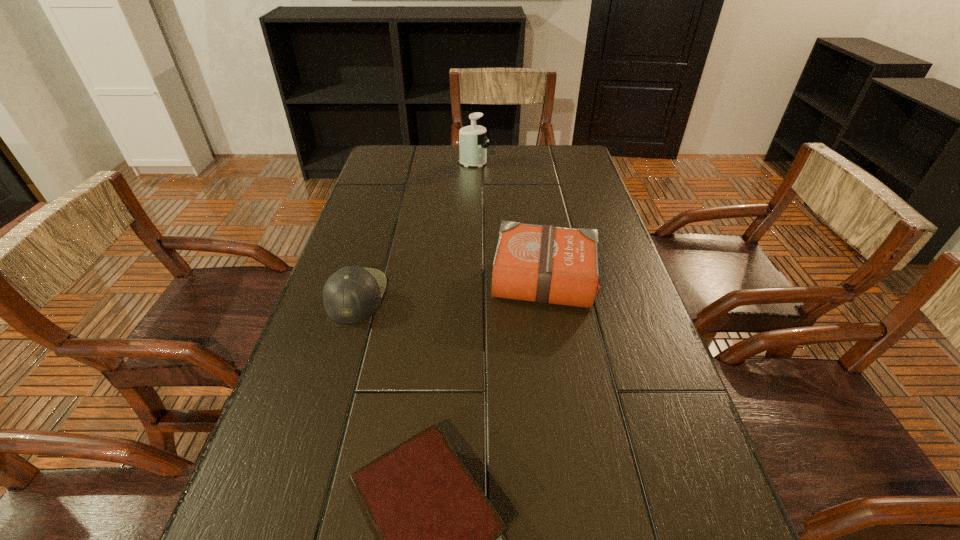
Find the location of a particular element. juicer is located at coordinates (472, 139).

I want to click on the farthest object, so click(472, 139).

Find the location of a particular element. The width and height of the screenshot is (960, 540). the farther Bible is located at coordinates (545, 264).

The height and width of the screenshot is (540, 960). I want to click on the third tallest object, so click(x=352, y=294).

You are a GUI agent. You are given a task and a screenshot of the screen. Output one action in this format:
    pyautogui.click(x=<x>, y=<y>)
    Task: Click on the leftmost object
    The image size is (960, 540).
    Given the screenshot: What is the action you would take?
    pos(352,294)

Locate an element on the screen. The image size is (960, 540). vacant space located on the right of the juicer is located at coordinates (577, 163).

What are the coordinates of `vacant space located 0.080m on the right of the taller Bible` in the screenshot? It's located at (630, 278).

You are a GUI agent. You are given a task and a screenshot of the screen. Output one action in this format:
    pyautogui.click(x=<x>, y=<y>)
    Task: Click on the blank area located on the brim of the leftmost object
    The image size is (960, 540).
    Given the screenshot: What is the action you would take?
    554,295

At what (x,y) coordinates should I click in order to perform the action: click on object that is at the far edge. Please return your answer as a coordinate pair (x, y). Looking at the image, I should click on (472, 139).

Locate an element on the screen. The height and width of the screenshot is (540, 960). object at the left edge is located at coordinates (352, 294).